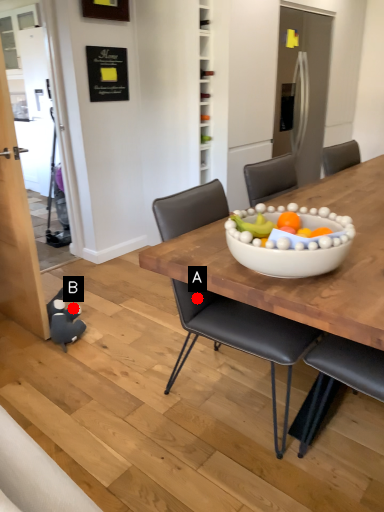
Question: Two points are circled on the image, labeled by A and B beside each circle. Which point is further to the camera?

Choices:
 (A) A is further
 (B) B is further

Answer: (B)